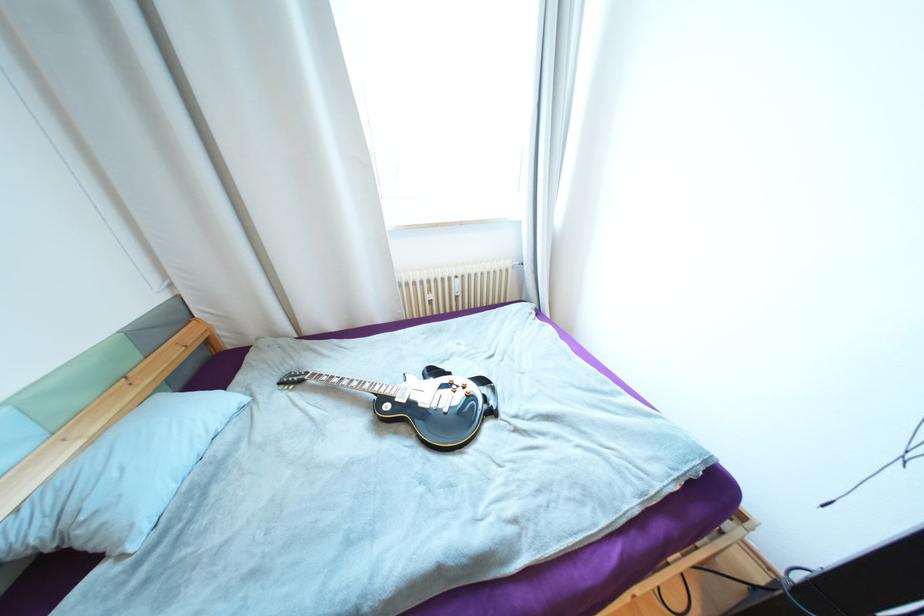
Where would you flip the guitar pickup switch? Please return your answer as a coordinate pair (x, y).

(438, 400)